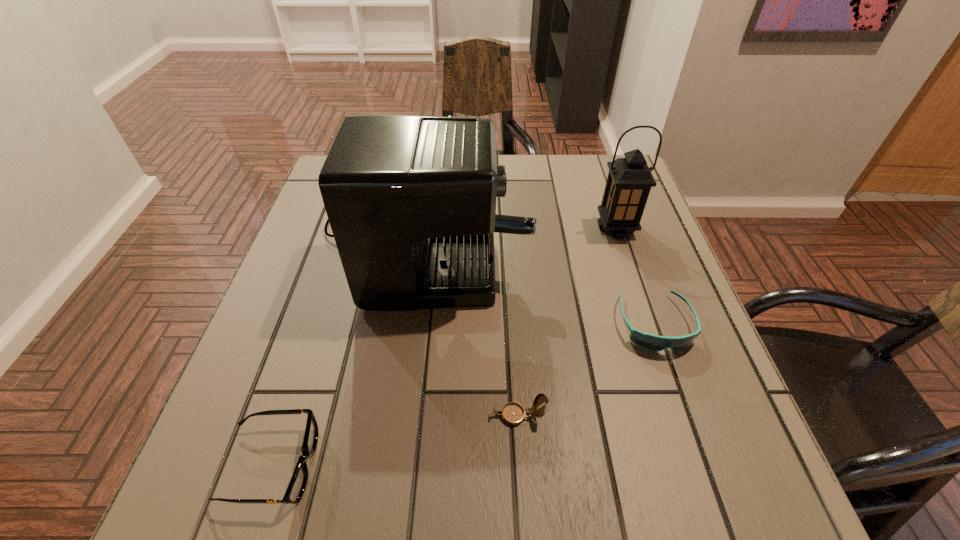
You are a GUI agent. You are given a task and a screenshot of the screen. Output one action in this format:
    pyautogui.click(x=<x>, y=<y>)
    Task: Click on the coffee maker
    The width and height of the screenshot is (960, 540).
    Given the screenshot: What is the action you would take?
    (411, 200)

You are a GUI agent. You are given a task and a screenshot of the screen. Output one action in this format:
    pyautogui.click(x=<x>, y=<y>)
    Task: Click on the second tallest object
    The height and width of the screenshot is (540, 960).
    Given the screenshot: What is the action you would take?
    629,181

Where is `the farther sunglasses`? the farther sunglasses is located at coordinates (648, 341).

You are a GUI agent. You are given a task and a screenshot of the screen. Output one action in this format:
    pyautogui.click(x=<x>, y=<y>)
    Task: Click on the compass
    
    Given the screenshot: What is the action you would take?
    pyautogui.click(x=513, y=413)

You are a GUI agent. You are given a task and a screenshot of the screen. Output one action in this format:
    pyautogui.click(x=<x>, y=<y>)
    Task: Click on the left sunglasses
    The width and height of the screenshot is (960, 540).
    Given the screenshot: What is the action you would take?
    pyautogui.click(x=295, y=490)

This screenshot has width=960, height=540. Identify the location of vacant space located 0.240m on the front-facing side of the tallest object. (621, 224).

Where is `free space located on the back of the fourth shortest object`? This screenshot has width=960, height=540. free space located on the back of the fourth shortest object is located at coordinates (599, 177).

The image size is (960, 540). Identify the location of vacant space located on the front-facing side of the farther sunglasses. (677, 389).

This screenshot has height=540, width=960. What are the coordinates of `blank space located 0.290m on the face of the compass` in the screenshot? It's located at (319, 415).

Identify the location of vacant space positioned 0.140m on the face of the compass. (407, 415).